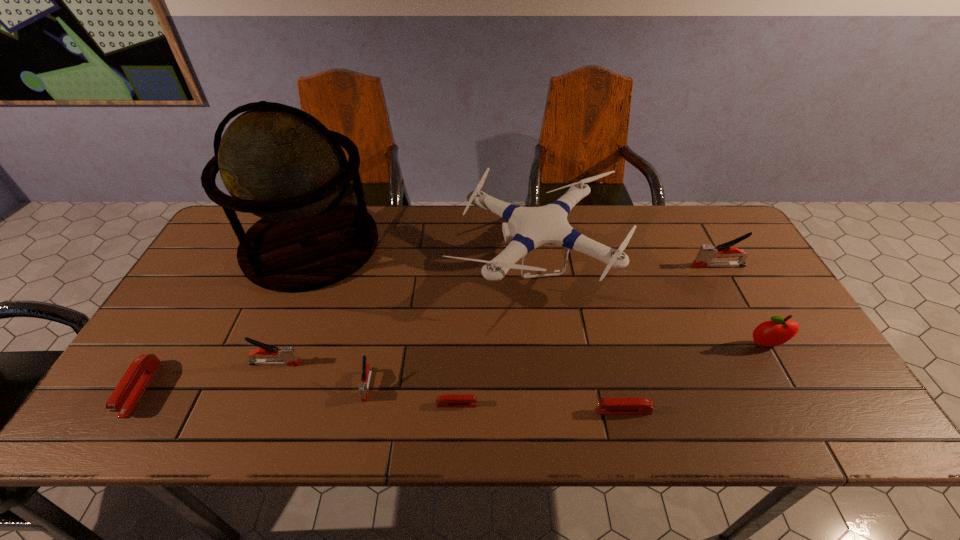
Locate an element on the screen. This screenshot has width=960, height=540. free space between the tallest object and the sixth nearest object is located at coordinates (539, 294).

The image size is (960, 540). Identify the location of vacant space that's between the second smallest red stapler and the fourth farthest object. (695, 378).

Where is `free area in between the tallest object and the blue drone`? free area in between the tallest object and the blue drone is located at coordinates (423, 252).

This screenshot has height=540, width=960. What are the coordinates of `free space between the third shortest object and the smallest gray stapler` in the screenshot? It's located at (254, 387).

Identify the location of free point between the nearest gray stapler and the second nearest gray stapler. The width and height of the screenshot is (960, 540). (322, 374).

At what (x,y) coordinates should I click in order to perform the action: click on vacant space in between the second tallest object and the second biggest gray stapler. Please return your answer as a coordinate pair (x, y). The width and height of the screenshot is (960, 540). Looking at the image, I should click on (405, 311).

The image size is (960, 540). In order to click on empty space between the rightmost red stapler and the leftmost gray stapler in this screenshot , I will do `click(449, 387)`.

Where is `free space between the fifth stapler from left to right and the shortest stapler`? The width and height of the screenshot is (960, 540). free space between the fifth stapler from left to right and the shortest stapler is located at coordinates (540, 408).

The image size is (960, 540). I want to click on free space between the second nearest gray stapler and the third shortest object, so click(208, 376).

The height and width of the screenshot is (540, 960). Find the location of `free area in between the leftmost red stapler and the smallest red stapler`. free area in between the leftmost red stapler and the smallest red stapler is located at coordinates (299, 396).